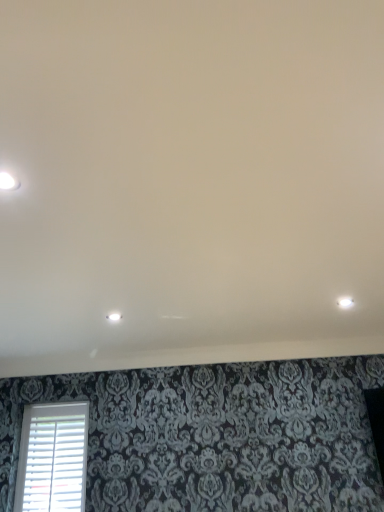
Question: Looking at their shapes, would you say white plastic blinds at lower left is wider or thinner than white matte ceiling at upper center?

Choices:
 (A) wide
 (B) thin

Answer: (B)

Question: Considering the positions of point (72, 402) and point (216, 289), is point (72, 402) closer or farther from the camera than point (216, 289)?

Choices:
 (A) closer
 (B) farther

Answer: (B)

Question: Which object is the closest to the white plastic blinds at lower left?

Choices:
 (A) white glossy light fixture at upper left, which ranks as the 1th dot in front-to-back order
 (B) white glossy light fixture at center, arranged as the second dot when viewed from the front
 (C) white matte ceiling at upper center

Answer: (B)

Question: Which object is positioned farthest from the white plastic blinds at lower left?

Choices:
 (A) white matte ceiling at upper center
 (B) white glossy light fixture at center, which ranks as the 1th dot in bottom-to-top order
 (C) white glossy light fixture at upper left, positioned as the 2th dot in back-to-front order

Answer: (C)